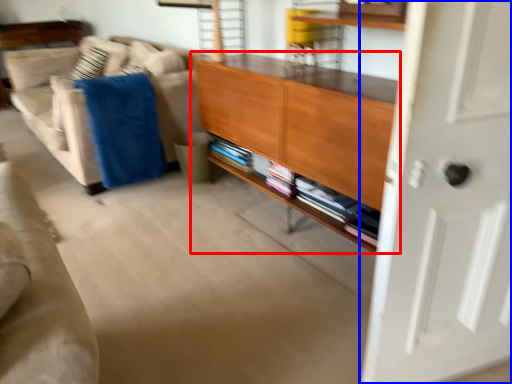
Question: Among these objects, which one is nearest to the camera, cabinetry (highlighted by a red box) or door (highlighted by a blue box)?

Choices:
 (A) cabinetry
 (B) door

Answer: (B)